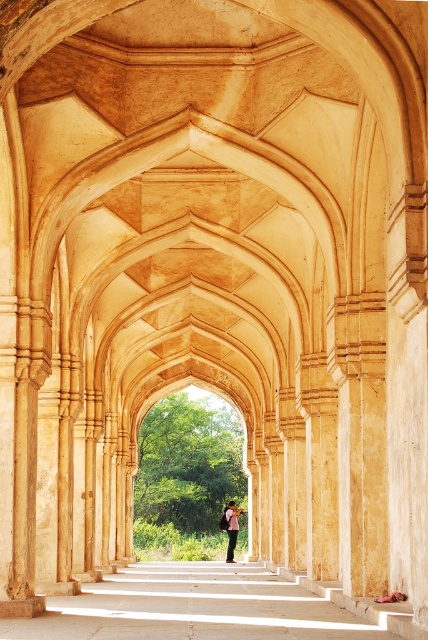
You are standing at the entrance of the archway corridor and see the smooth stone path at center and the light pink fabric at center. Which object takes up more space in the image?

The smooth stone path at center is bigger than the light pink fabric at center, so it takes up more space in the image.

You are standing inside the corridor formed by the arches and want to walk towards the exit where the sunlight is coming from. There are two points marked on the floor ahead of you. Which point is closer to you as you face the exit? The points are labeled as point (x=216, y=637) and point (x=228, y=531).

Point (x=216, y=637) is closer to the viewer than point (x=228, y=531), so the point labeled (x=216, y=637) is closer to you as you face the exit.